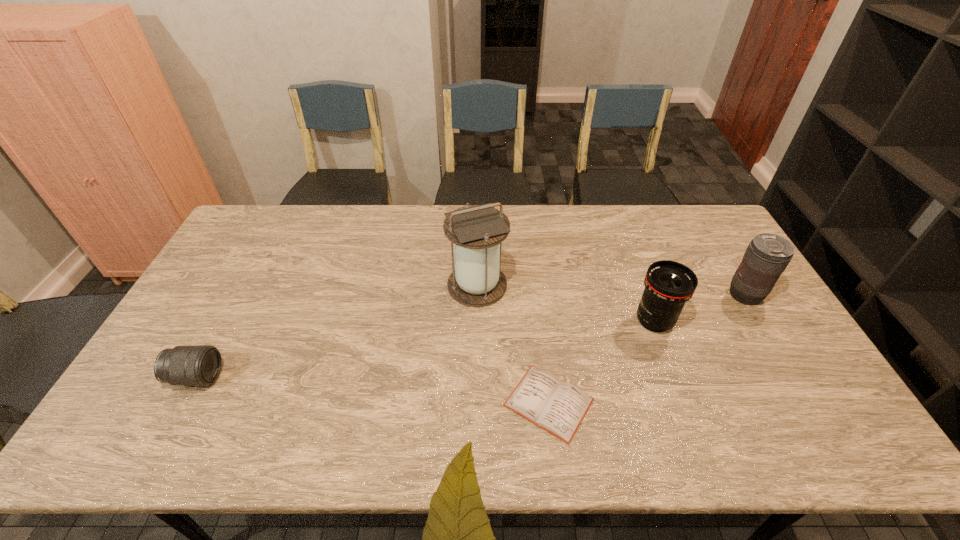
Select which object is the fourth closest to the rightmost telephoto lens. Please provide its 2D coordinates. Your answer should be formatted as a tuple, i.e. [(x, y)], where the tuple contains the x and y coordinates of a point satisfying the conditions above.

[(200, 365)]

I want to click on object that ranks as the third closest to the fourth tallest object, so click(x=669, y=285).

Find the location of `the second closest telephoto lens to the shortest telephoto lens`. the second closest telephoto lens to the shortest telephoto lens is located at coordinates (767, 256).

Locate which telephoto lens is the second closest to the shortest object. Please provide its 2D coordinates. Your answer should be formatted as a tuple, i.e. [(x, y)], where the tuple contains the x and y coordinates of a point satisfying the conditions above.

[(767, 256)]

Where is `vacant point that satisfies the following two spatial constraints: 1. on the surface of the shortest object; 2. on the left side of the shortest telephoto lens`? The image size is (960, 540). vacant point that satisfies the following two spatial constraints: 1. on the surface of the shortest object; 2. on the left side of the shortest telephoto lens is located at coordinates (182, 402).

Find the location of a particular element. The image size is (960, 540). vacant position in the image that satisfies the following two spatial constraints: 1. on the front side of the tallest object; 2. on the surface of the second shortest object is located at coordinates (476, 377).

Identify the location of blank space that satisfies the following two spatial constraints: 1. on the side of the rightmost telephoto lens where the control switches are located; 2. on the front side of the fourth object from left to right. The width and height of the screenshot is (960, 540). (760, 321).

Locate an element on the screen. The height and width of the screenshot is (540, 960). vacant region that satisfies the following two spatial constraints: 1. on the side of the rightmost telephoto lens where the control switches are located; 2. on the front side of the shortest object is located at coordinates (808, 402).